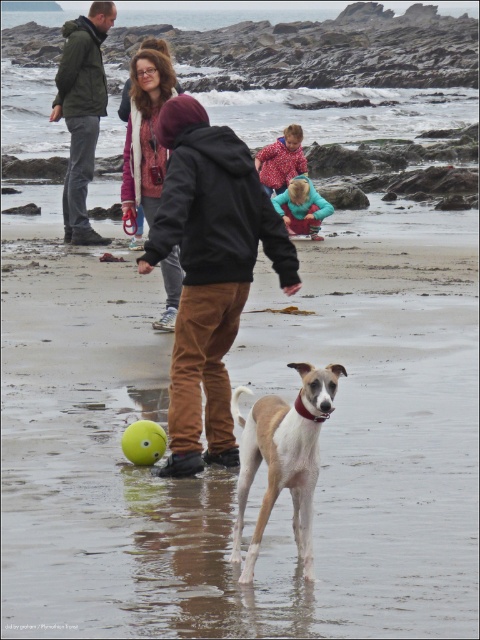
You are standing at the point marked as point (x=64, y=545) and want to walk towards the point (x=145, y=433). Based on the scene description, will you be moving towards the camera or away from it?

Since point (x=64, y=545) is closer to the camera than point (x=145, y=433), moving from point (x=64, y=545) to point (x=145, y=433) means you are moving away from the camera.